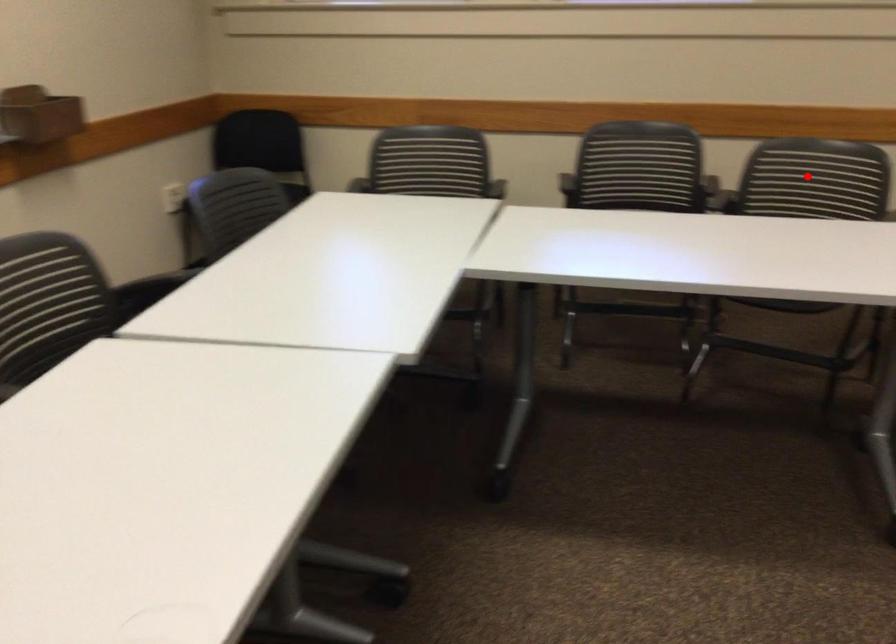
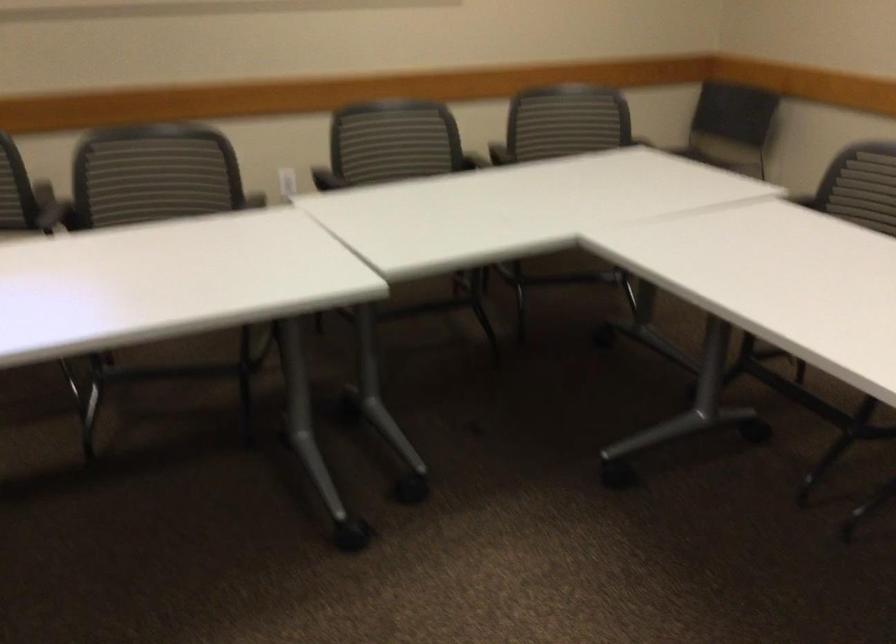
In the second image, find the point that corresponds to the highlighted location in the first image.

(154, 176)